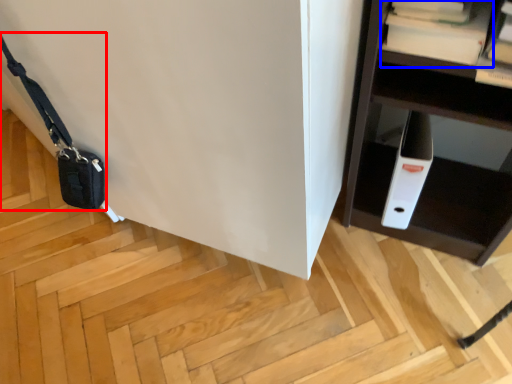
Question: Among these objects, which one is farthest to the camera, messenger bag (highlighted by a red box) or book (highlighted by a blue box)?

Choices:
 (A) messenger bag
 (B) book

Answer: (A)